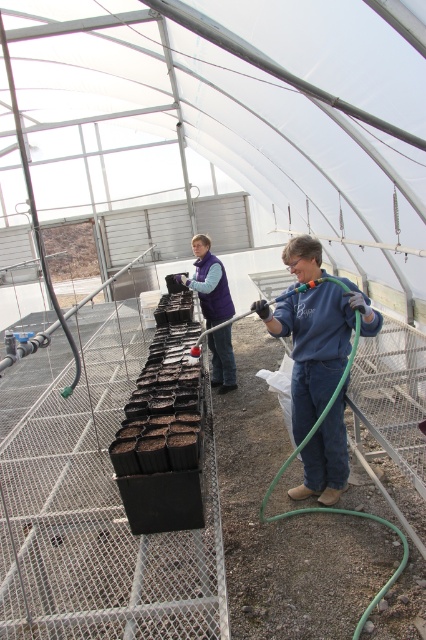
You are standing inside the greenhouse and want to take a photo of the two points marked in the image. Which point, point (321,275) or point (218,301), will appear larger in your photo?

Point (321,275) will appear larger in the photo because it is closer to the camera than point (218,301).

In the scene shown: You are standing in the greenhouse and need to find the blue fleece jacket at right. According to the coordinates provided, where should you look to locate it?

The blue fleece jacket at right is located at point coordinates (317,342).

You are standing in the greenhouse and want to reach the point at coordinates (313, 298). The greenhouse has a metal mesh floor. Can you walk directly to this point without stepping on any of the black plastic pots on the raised metal shelf?

The point at coordinates (313, 298) is 3.21 meters away from the camera. Since the black plastic pots are on a raised metal shelf in the foreground, they are likely positioned above the metal mesh floor where you would walk. Therefore, you can walk directly to the point without stepping on the pots as they are elevated on the shelf.